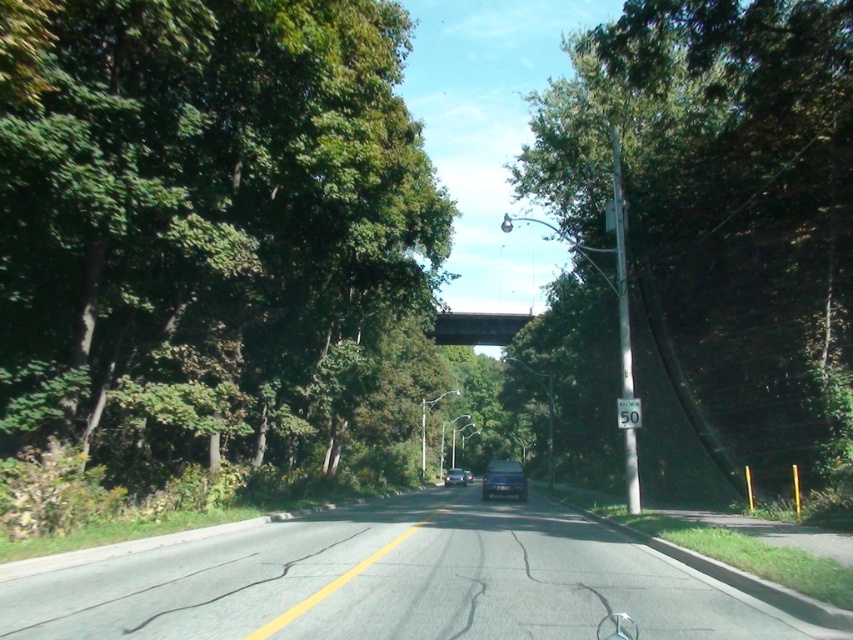
Is green metallic pole at right thinner than concrete bridge at center?

Correct, green metallic pole at right's width is less than concrete bridge at center's.

Is point (618, 204) behind point (461, 324)?

No, it is in front of (461, 324).

The height and width of the screenshot is (640, 853). Find the location of `green metallic pole at right`. green metallic pole at right is located at coordinates (621, 269).

Does asphalt road at center have a greater height compared to shiny black sedan at center?

No.

At what (x,y) coordinates should I click in order to perform the action: click on asphalt road at center. Please return your answer as a coordinate pair (x, y). This screenshot has width=853, height=640. Looking at the image, I should click on (393, 582).

Identify the location of asphalt road at center. This screenshot has width=853, height=640. (393, 582).

Which is above, concrete bridge at center or shiny black sedan at center?

concrete bridge at center is above.

Find the location of a particular element. The height and width of the screenshot is (640, 853). concrete bridge at center is located at coordinates (476, 326).